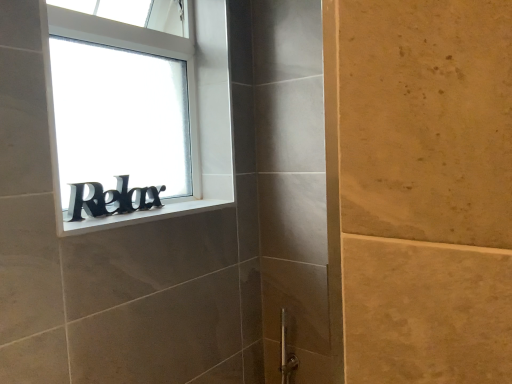
Find the location of `black matte sign at window`. black matte sign at window is located at coordinates (110, 199).

You are a GUI agent. You are given a task and a screenshot of the screen. Output one action in this format:
    pyautogui.click(x=<x>, y=<y>)
    Task: Click on the white matte window sill at upper left
    The height and width of the screenshot is (384, 512).
    Given the screenshot: What is the action you would take?
    pyautogui.click(x=142, y=215)

I want to click on black matte sign at upper left, so click(x=137, y=117).

From the image's perspective, is black matte sign at window above black matte sign at upper left?

No, from the image's perspective, black matte sign at window is not over black matte sign at upper left.

This screenshot has height=384, width=512. In order to click on window in front of the black matte sign at window in this screenshot , I will do `click(137, 117)`.

Does black matte sign at window lie in front of black matte sign at upper left?

No, it is not.

Is black matte sign at window directly adjacent to white matte window sill at upper left?

Yes, black matte sign at window is with white matte window sill at upper left.

Where is `window sill below the black matte sign at window (from a real-world perspective)`? window sill below the black matte sign at window (from a real-world perspective) is located at coordinates (142, 215).

Which object is further away from the camera, black matte sign at window or white matte window sill at upper left?

black matte sign at window is further away from the camera.

Does white matte window sill at upper left appear on the left side of black matte sign at upper left?

Incorrect, white matte window sill at upper left is not on the left side of black matte sign at upper left.

Locate an element on the screen. window behind the white matte window sill at upper left is located at coordinates (137, 117).

Is white matte window sill at upper left not inside black matte sign at upper left?

white matte window sill at upper left lies outside black matte sign at upper left's area.

Considering the points (206, 175) and (102, 187), which point is behind, point (206, 175) or point (102, 187)?

The point (206, 175) is farther from the camera.

Considering the relative positions of black matte sign at upper left and black matte sign at window in the image provided, is black matte sign at upper left in front of black matte sign at window?

Yes, it is.

Which of these two, black matte sign at upper left or black matte sign at window, is bigger?

black matte sign at upper left is bigger.

From a real-world perspective, between black matte sign at upper left and black matte sign at window, who is vertically higher?

black matte sign at upper left, from a real-world perspective.

Where is `writing that appears behind the white matte window sill at upper left`? writing that appears behind the white matte window sill at upper left is located at coordinates (110, 199).

Between white matte window sill at upper left and black matte sign at window, which one appears on the right side from the viewer's perspective?

white matte window sill at upper left is more to the right.

Is point (112, 224) closer or farther from the camera than point (149, 191)?

Clearly, point (112, 224) is closer to the camera than point (149, 191).

Is white matte window sill at upper left positioned with its back to black matte sign at window?

No, white matte window sill at upper left's orientation is not away from black matte sign at window.

This screenshot has height=384, width=512. What are the coordinates of `window that is on the left side of white matte window sill at upper left` in the screenshot? It's located at (137, 117).

Which is closer, (177, 49) or (60, 235)?

Answer: Point (177, 49).

Considering their positions, is black matte sign at upper left located in front of or behind white matte window sill at upper left?

black matte sign at upper left is positioned farther from the viewer than white matte window sill at upper left.

Is black matte sign at upper left positioned far away from white matte window sill at upper left?

Actually, black matte sign at upper left and white matte window sill at upper left are a little close together.

Where is `window that appears in front of the black matte sign at window`? window that appears in front of the black matte sign at window is located at coordinates (137, 117).

Identify the location of writing on the left of white matte window sill at upper left. The image size is (512, 384). (110, 199).

Based on their spatial positions, is black matte sign at upper left or black matte sign at window closer to white matte window sill at upper left?

black matte sign at window is closer to white matte window sill at upper left.

Which object lies further to the anchor point black matte sign at window, white matte window sill at upper left or black matte sign at upper left?

The object further to black matte sign at window is black matte sign at upper left.

Based on their spatial positions, is white matte window sill at upper left or black matte sign at window closer to black matte sign at upper left?

Based on the image, black matte sign at window appears to be nearer to black matte sign at upper left.

Based on their spatial positions, is black matte sign at upper left or white matte window sill at upper left further from black matte sign at window?

The object further to black matte sign at window is black matte sign at upper left.

From the image, which object appears to be farther from white matte window sill at upper left, black matte sign at window or black matte sign at upper left?

The object further to white matte window sill at upper left is black matte sign at upper left.

Based on their spatial positions, is black matte sign at window or white matte window sill at upper left further from black matte sign at upper left?

white matte window sill at upper left lies further to black matte sign at upper left than the other object.

Locate an element on the screen. This screenshot has height=384, width=512. writing between black matte sign at upper left and white matte window sill at upper left in the up-down direction is located at coordinates (110, 199).